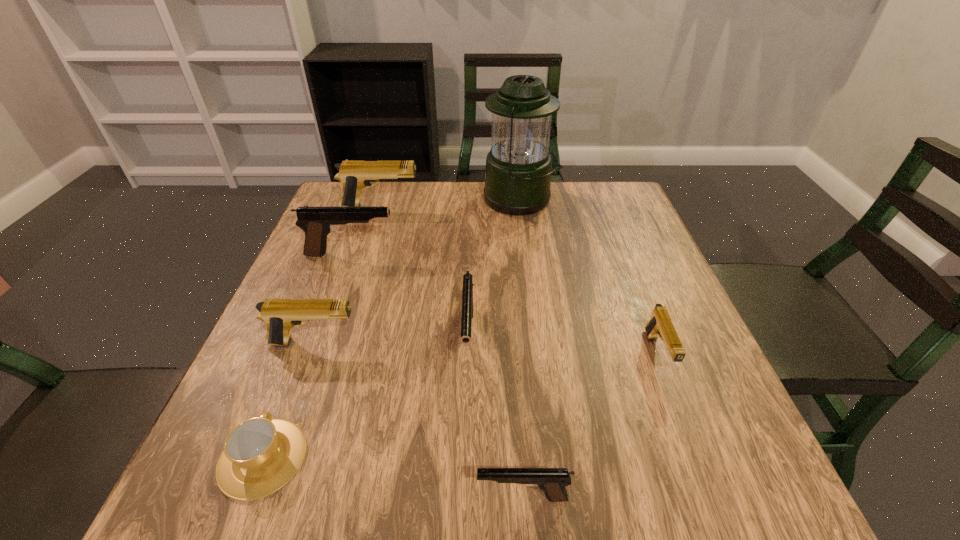
You are a GUI agent. You are given a task and a screenshot of the screen. Output one action in this format:
    pyautogui.click(x=<x>, y=<y>)
    Task: Click on the rightmost pistol
    The height and width of the screenshot is (540, 960).
    Given the screenshot: What is the action you would take?
    pyautogui.click(x=660, y=325)

Where is `the smallest black pistol`? The height and width of the screenshot is (540, 960). the smallest black pistol is located at coordinates (552, 481).

Where is `the second pistol from right to left`? the second pistol from right to left is located at coordinates (552, 481).

This screenshot has height=540, width=960. What are the coordinates of `the shortest object` in the screenshot? It's located at (260, 455).

You are a GUI agent. You are given a task and a screenshot of the screen. Output one action in this format:
    pyautogui.click(x=<x>, y=<y>)
    Task: Click on the cup
    The height and width of the screenshot is (540, 960).
    Given the screenshot: What is the action you would take?
    pyautogui.click(x=260, y=455)

I want to click on vacant region located 0.350m on the front of the tallest object, so click(535, 309).

I want to click on free space located 0.100m at the barrel of the farthest tan pistol, so click(x=455, y=207).

Locate an element on the screen. This screenshot has width=960, height=540. free location located 0.090m at the muzzle of the biggest black pistol is located at coordinates pos(432,254).

In order to click on vacant area situated 0.200m at the barrel of the second biggest tan pistol in this screenshot , I will do `click(460, 343)`.

Locate an element on the screen. The image size is (960, 540). free space located 0.240m at the muzzle of the second biggest black pistol is located at coordinates (464, 512).